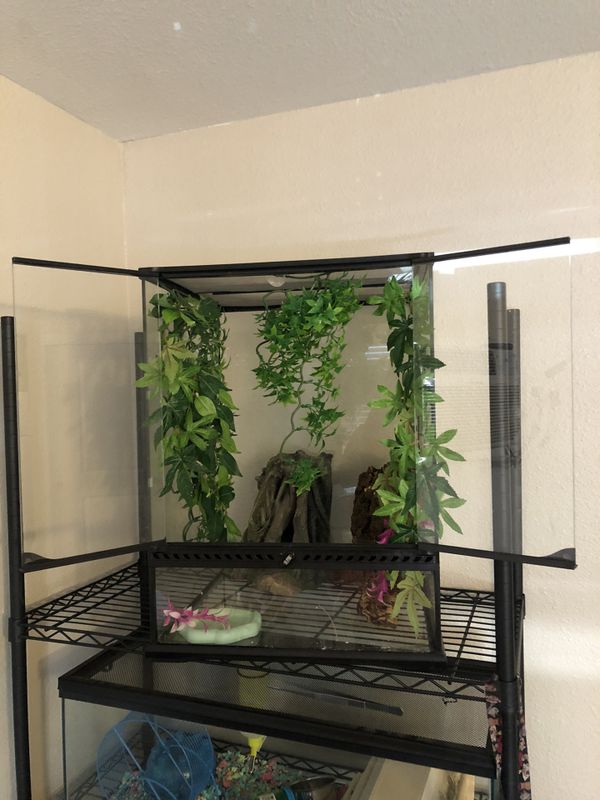
I want to click on shelf, so click(x=85, y=621).